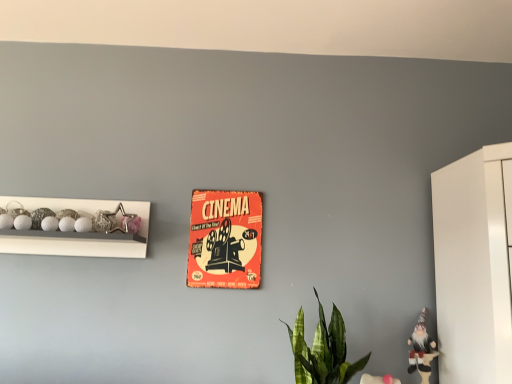
Question: Does white glossy beads at left appear on the right side of metallic star at left, arranged as the first toy when viewed from the top?

Choices:
 (A) no
 (B) yes

Answer: (A)

Question: Is white glossy beads at left looking in the opposite direction of metallic star at left, which is the second toy in bottom-to-top order?

Choices:
 (A) no
 (B) yes

Answer: (B)

Question: Is white glossy beads at left shorter than metallic star at left, arranged as the first toy when viewed from the top?

Choices:
 (A) yes
 (B) no

Answer: (B)

Question: Could metallic star at left, which is the second toy in bottom-to-top order, be considered to be inside white glossy beads at left?

Choices:
 (A) no
 (B) yes

Answer: (B)

Question: From a real-world perspective, is white glossy beads at left physically above metallic star at left, the 2th toy when ordered from right to left?

Choices:
 (A) no
 (B) yes

Answer: (A)

Question: Is white glossy beads at left located outside metallic star at left, which is the second toy in bottom-to-top order?

Choices:
 (A) no
 (B) yes

Answer: (B)

Question: Considering the relative sizes of white glossy beads at left and green leafy plant at lower center in the image provided, is white glossy beads at left taller than green leafy plant at lower center?

Choices:
 (A) yes
 (B) no

Answer: (B)

Question: Is white glossy beads at left positioned far away from green leafy plant at lower center?

Choices:
 (A) yes
 (B) no

Answer: (B)

Question: From a real-world perspective, is white glossy beads at left physically above green leafy plant at lower center?

Choices:
 (A) no
 (B) yes

Answer: (B)

Question: Does white glossy beads at left have a larger size compared to green leafy plant at lower center?

Choices:
 (A) yes
 (B) no

Answer: (A)

Question: Is white glossy beads at left not inside green leafy plant at lower center?

Choices:
 (A) no
 (B) yes

Answer: (B)

Question: Can you confirm if white glossy beads at left is smaller than green leafy plant at lower center?

Choices:
 (A) yes
 (B) no

Answer: (B)

Question: Does orange paper poster at center lie behind green leafy plant at lower center?

Choices:
 (A) no
 (B) yes

Answer: (B)